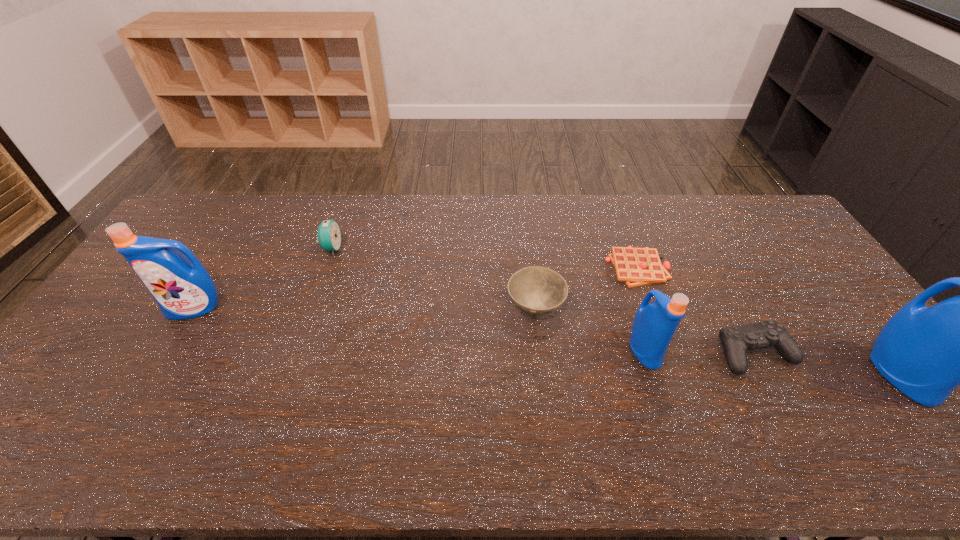
Where is `the sixth tallest object`? the sixth tallest object is located at coordinates (737, 340).

I want to click on the fifth tallest object, so click(535, 290).

Locate an element on the screen. The width and height of the screenshot is (960, 540). the fifth object from right to left is located at coordinates (535, 290).

This screenshot has height=540, width=960. I want to click on free spot located 0.140m on the label of the second tallest object, so click(163, 362).

Where is `blank space located 0.120m on the label of the second detergent from left to right`? The width and height of the screenshot is (960, 540). blank space located 0.120m on the label of the second detergent from left to right is located at coordinates (702, 350).

Locate an element on the screen. free point located 0.300m on the front-facing side of the fourth tallest object is located at coordinates (430, 248).

I want to click on vacant space located 0.140m on the right of the shortest object, so click(712, 268).

You are a GUI agent. You are given a task and a screenshot of the screen. Output one action in this format:
    pyautogui.click(x=<x>, y=<y>)
    Task: Click on the free location located on the back of the control
    
    Given the screenshot: What is the action you would take?
    pyautogui.click(x=712, y=273)

Identify the location of vacant space located 0.210m on the left of the bowl. (435, 308).

You are a GUI agent. You are given a task and a screenshot of the screen. Output one action in this format:
    pyautogui.click(x=<x>, y=<y>)
    Task: Click on the object at the near edge
    Image resolution: width=960 pixels, height=540 pixels.
    Given the screenshot: What is the action you would take?
    pyautogui.click(x=926, y=353)